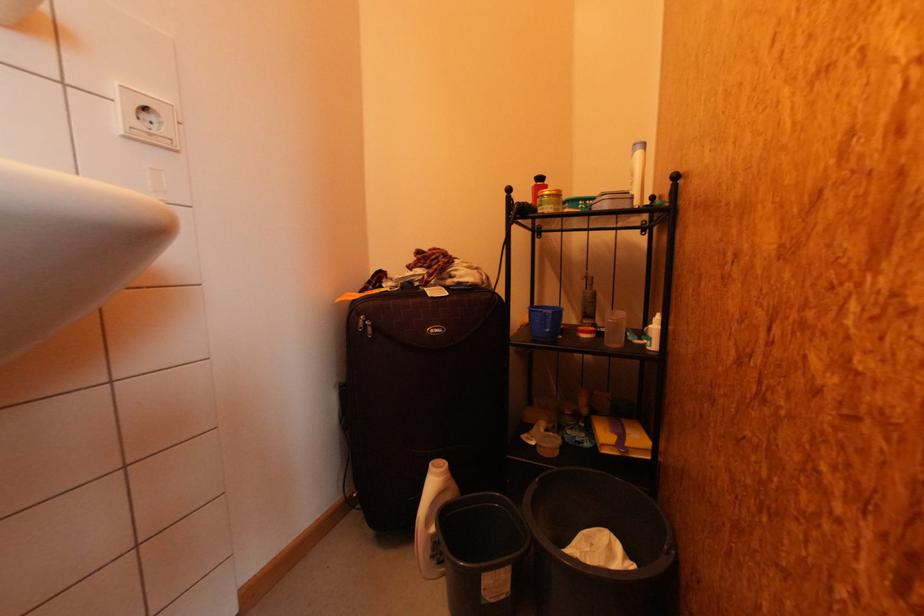
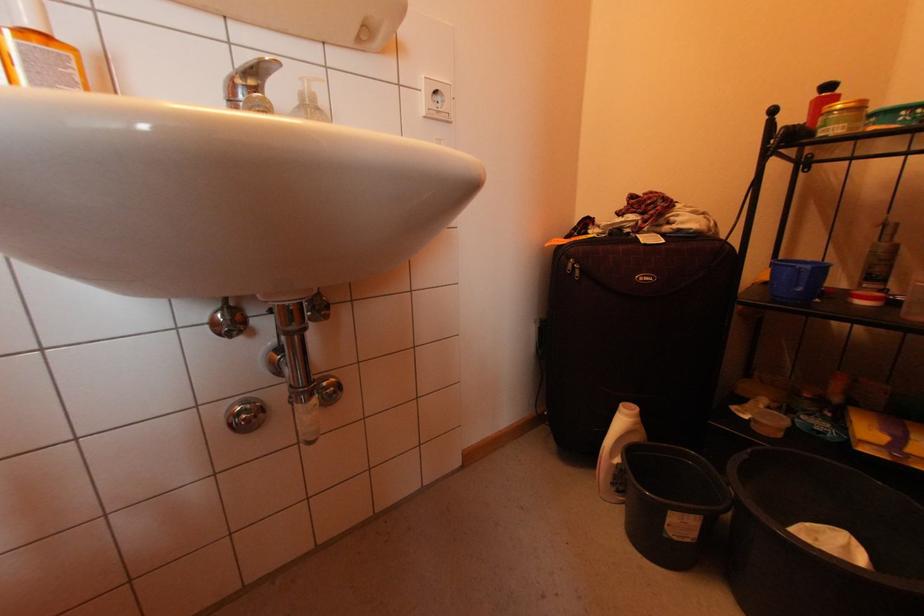
In the second image, find the point that corresponds to [617,536] in the first image.

(860, 541)